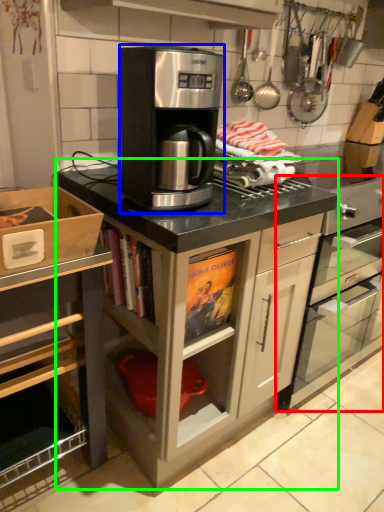
Question: Which is farther away from home appliance (highlighted by a red box)? kitchen appliance (highlighted by a blue box) or cabinetry (highlighted by a green box)?

Choices:
 (A) kitchen appliance
 (B) cabinetry

Answer: (A)